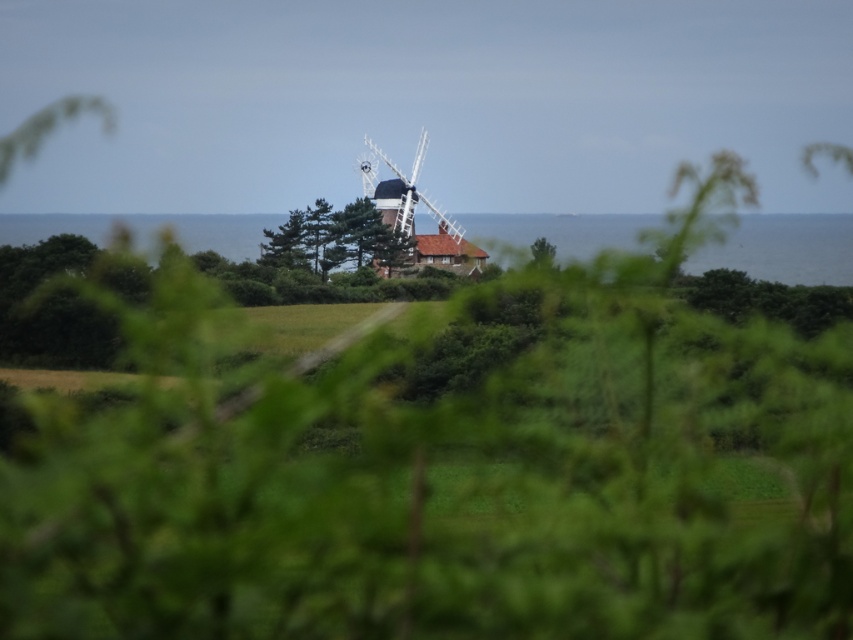
You are standing on the shore looking at the blue water at center and the white wooden windmill at center. Which object is closer to your viewpoint?

The blue water at center is positioned under the white wooden windmill at center, so the white wooden windmill at center is closer to your viewpoint.

You are a photographer trying to capture the white wooden windmill at center in your shot. However, the green leafy tree at center is blocking part of it. Can you determine which object is wider so you know which one to adjust your camera angle around?

The green leafy tree at center is wider than the white wooden windmill at center, so you should adjust your camera angle to avoid the wider tree and focus on the windmill.

You are standing in a field looking at the scene. There is blue water at center and a white wooden windmill at center. Which object is positioned to the right of the other?

The blue water at center is positioned to the right of the white wooden windmill at center.